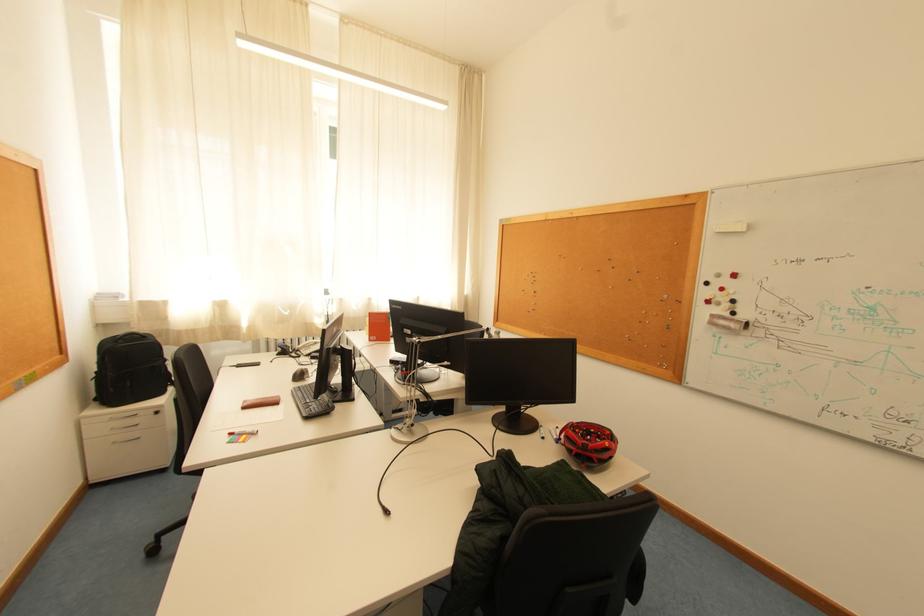
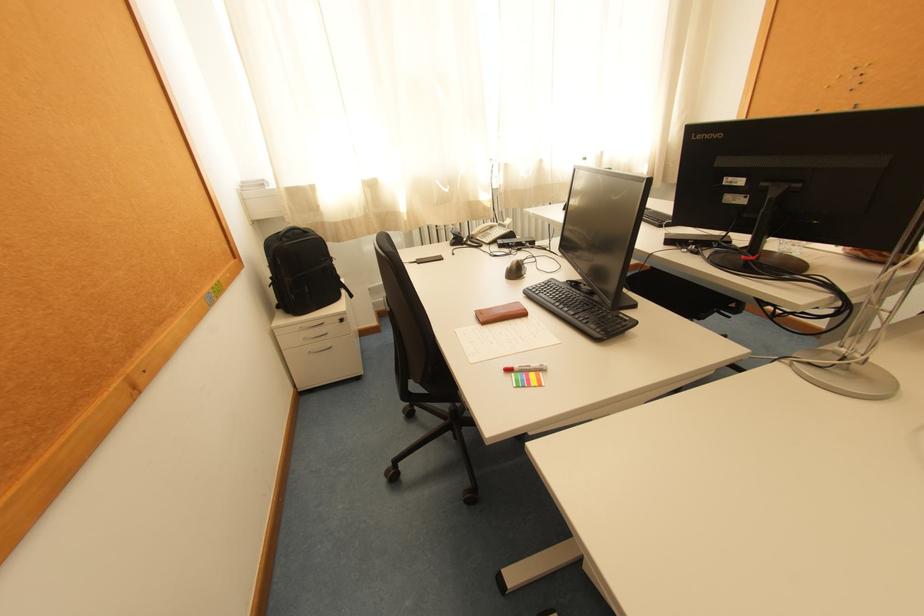
The images are taken continuously from a first-person perspective. In which direction are you moving?

The cameraman moved toward left, forward.